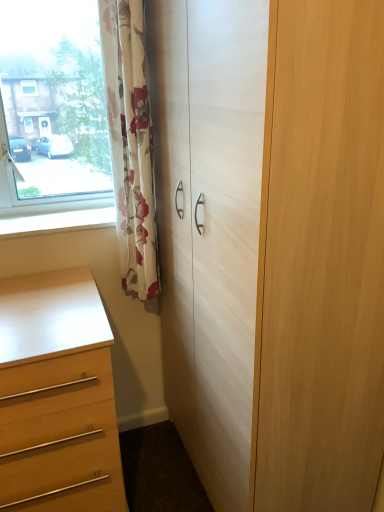
Question: Do you think white wood cupboard at center is within white glossy window sill at lower left, or outside of it?

Choices:
 (A) inside
 (B) outside

Answer: (B)

Question: From the image's perspective, is white wood cupboard at center positioned above or below white glossy window sill at lower left?

Choices:
 (A) below
 (B) above

Answer: (A)

Question: Based on their relative distances, which object is farther from the matte wood chest of drawers at lower left?

Choices:
 (A) white wood cupboard at center
 (B) white glossy window sill at lower left
 (C) floral fabric curtain at left

Answer: (A)

Question: Estimate the real-world distances between objects in this image. Which object is farther from the matte wood chest of drawers at lower left?

Choices:
 (A) white glossy window sill at lower left
 (B) floral fabric curtain at left
 (C) white wood cupboard at center

Answer: (C)